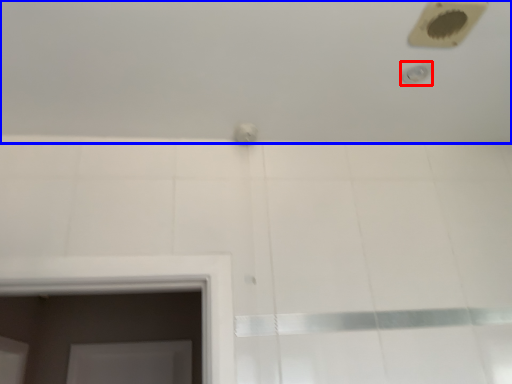
Question: Which point is closer to the camera, shower (highlighted by a red box) or bath (highlighted by a blue box)?

Choices:
 (A) shower
 (B) bath

Answer: (B)